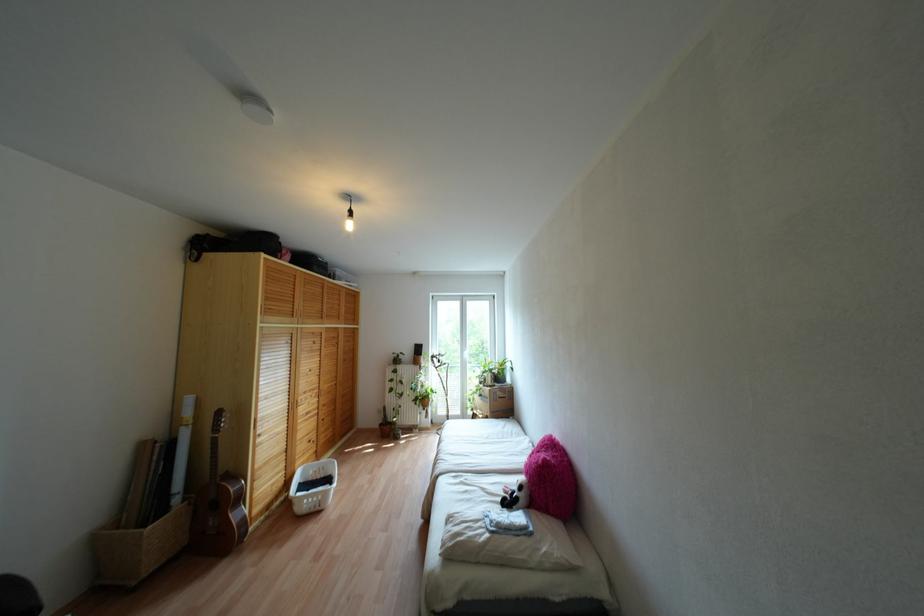
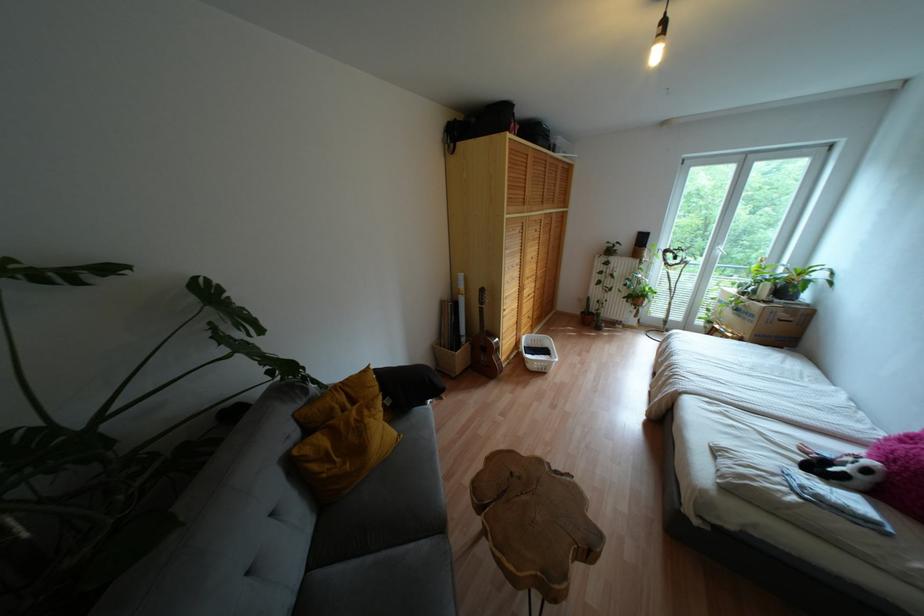
Where in the second image is the point corresponding to [466,353] from the first image?

(723, 248)